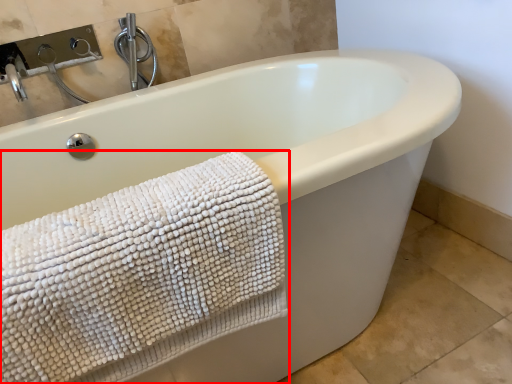
Question: From the image, what is the correct spatial relationship of towel (annotated by the red box) in relation to faucet?

Choices:
 (A) left
 (B) right

Answer: (B)